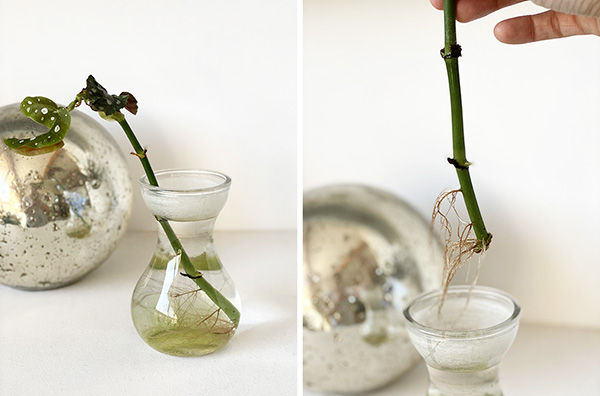
Find the location of a particular element. green plant is located at coordinates [106, 100].